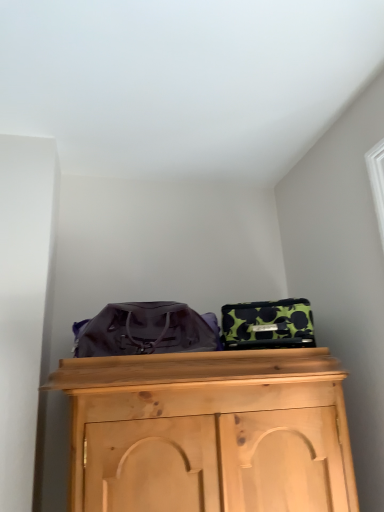
Question: Considering their positions, is matte purple messenger bag at center located in front of or behind green polka dot fabric suitcase at upper right?

Choices:
 (A) behind
 (B) front

Answer: (B)

Question: Is matte purple messenger bag at center taller or shorter than green polka dot fabric suitcase at upper right?

Choices:
 (A) short
 (B) tall

Answer: (B)

Question: Do you think matte purple messenger bag at center is within green polka dot fabric suitcase at upper right, or outside of it?

Choices:
 (A) outside
 (B) inside

Answer: (A)

Question: In the image, is green polka dot fabric suitcase at upper right on the left side or the right side of matte purple messenger bag at center?

Choices:
 (A) left
 (B) right

Answer: (B)

Question: From the image's perspective, is green polka dot fabric suitcase at upper right located above or below matte purple messenger bag at center?

Choices:
 (A) above
 (B) below

Answer: (B)

Question: Is green polka dot fabric suitcase at upper right wider or thinner than matte purple messenger bag at center?

Choices:
 (A) wide
 (B) thin

Answer: (B)

Question: From a real-world perspective, relative to matte purple messenger bag at center, is green polka dot fabric suitcase at upper right vertically above or below?

Choices:
 (A) above
 (B) below

Answer: (B)